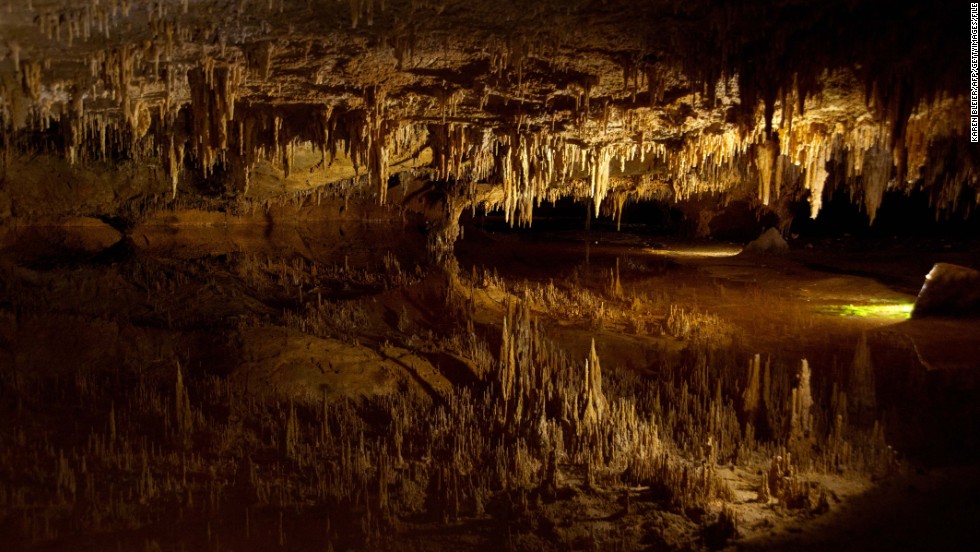
At what (x,y) coordinates should I click in order to perform the action: click on brown wall. Please return your answer as a coordinate pair (x, y). This screenshot has width=980, height=552. Looking at the image, I should click on (207, 230), (337, 215).